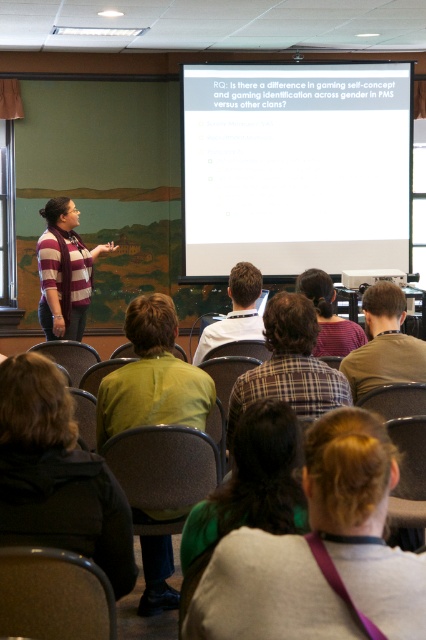
Who is more forward, (402, 179) or (278, 616)?

Point (278, 616)

Does white matte projection screen at upper center have a greater height compared to green fabric shirt at center?

Indeed, white matte projection screen at upper center has a greater height compared to green fabric shirt at center.

Is point (379, 140) less distant than point (308, 500)?

No, it is behind (308, 500).

The width and height of the screenshot is (426, 640). I want to click on white matte projection screen at upper center, so click(296, 166).

Between plaid fabric shirt at center and brown plaid shirt at center, which one appears on the left side from the viewer's perspective?

Positioned to the left is plaid fabric shirt at center.

Where is `plaid fabric shirt at center`? The height and width of the screenshot is (640, 426). plaid fabric shirt at center is located at coordinates click(x=290, y=364).

Is green fabric shirt at center taller than green fabric hair at center?

Yes, green fabric shirt at center is taller than green fabric hair at center.

This screenshot has width=426, height=640. In order to click on green fabric shirt at center in this screenshot , I will do `click(317, 550)`.

The image size is (426, 640). Find the location of `green fabric shirt at center`. green fabric shirt at center is located at coordinates (317, 550).